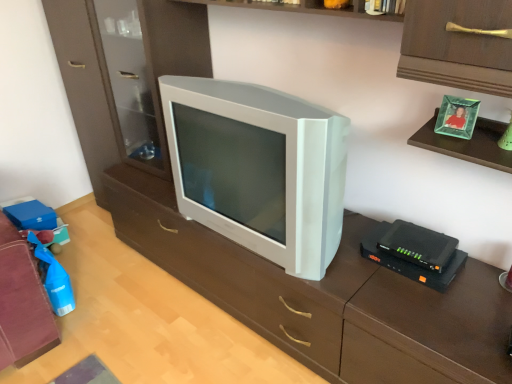
Question: Does black plastic router at right lie behind white plastic television at center?

Choices:
 (A) no
 (B) yes

Answer: (B)

Question: Can you confirm if black plastic router at right is positioned to the left of white plastic television at center?

Choices:
 (A) yes
 (B) no

Answer: (B)

Question: From a real-world perspective, does black plastic router at right sit lower than white plastic television at center?

Choices:
 (A) no
 (B) yes

Answer: (B)

Question: From the image's perspective, does black plastic router at right appear higher than white plastic television at center?

Choices:
 (A) yes
 (B) no

Answer: (B)

Question: Does black plastic router at right have a smaller size compared to white plastic television at center?

Choices:
 (A) yes
 (B) no

Answer: (A)

Question: Is point (438, 269) closer or farther from the camera than point (279, 279)?

Choices:
 (A) farther
 (B) closer

Answer: (B)

Question: Considering the positions of black plastic router at right and white plastic tv at center in the image, is black plastic router at right taller or shorter than white plastic tv at center?

Choices:
 (A) tall
 (B) short

Answer: (B)

Question: From the image's perspective, relative to white plastic tv at center, is black plastic router at right above or below?

Choices:
 (A) below
 (B) above

Answer: (B)

Question: Is black plastic router at right inside or outside of white plastic tv at center?

Choices:
 (A) inside
 (B) outside

Answer: (B)

Question: From the image's perspective, is white plastic television at center positioned above or below white plastic tv at center?

Choices:
 (A) below
 (B) above

Answer: (B)

Question: In the image, is white plastic television at center positioned in front of or behind white plastic tv at center?

Choices:
 (A) behind
 (B) front

Answer: (A)

Question: Is white plastic television at center spatially inside white plastic tv at center, or outside of it?

Choices:
 (A) inside
 (B) outside

Answer: (B)

Question: Considering the relative positions of white plastic television at center and white plastic tv at center in the image provided, is white plastic television at center to the left or to the right of white plastic tv at center?

Choices:
 (A) left
 (B) right

Answer: (B)

Question: Considering the positions of point (x=415, y=248) and point (x=305, y=130), is point (x=415, y=248) closer or farther from the camera than point (x=305, y=130)?

Choices:
 (A) closer
 (B) farther

Answer: (B)

Question: Is black plastic router at right wider or thinner than white plastic television at center?

Choices:
 (A) wide
 (B) thin

Answer: (B)